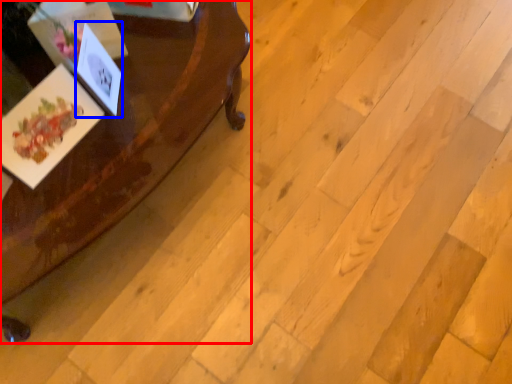
Question: Among these objects, which one is nearest to the camera, table (highlighted by a red box) or postcard (highlighted by a blue box)?

Choices:
 (A) table
 (B) postcard

Answer: (A)